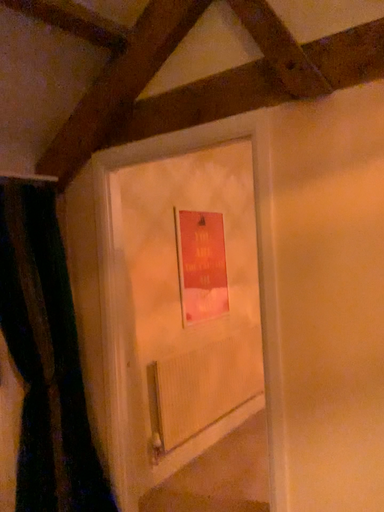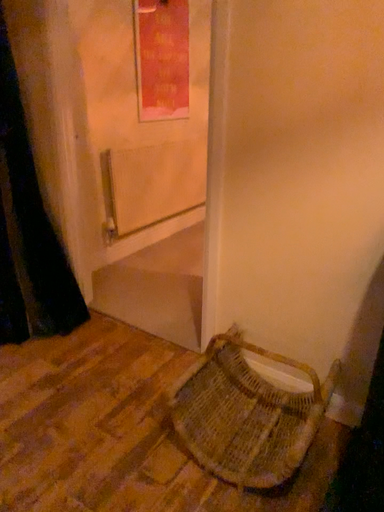
Question: Which way did the camera rotate in the video?

Choices:
 (A) rotated upward
 (B) rotated downward

Answer: (B)